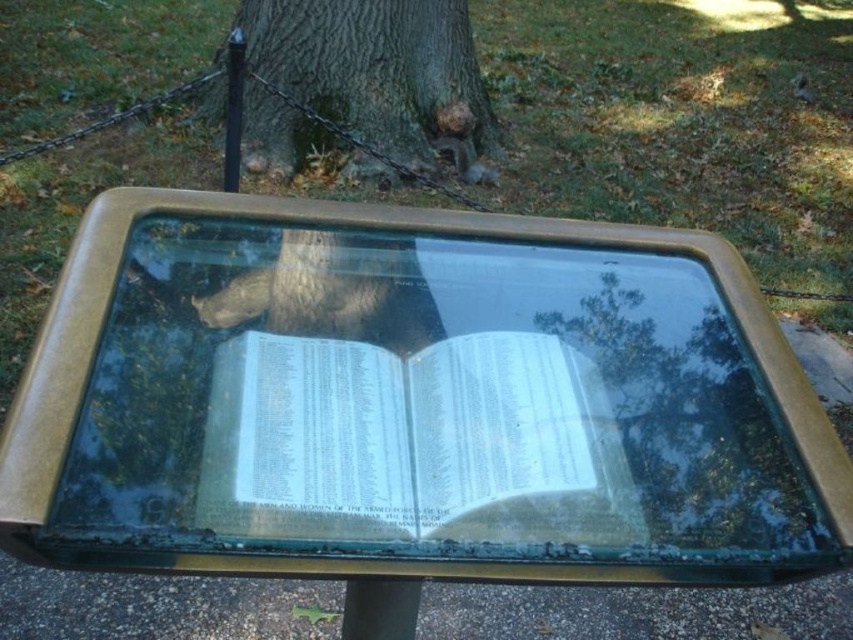
This screenshot has height=640, width=853. Describe the element at coordinates (410, 442) in the screenshot. I see `white paper book at center` at that location.

Does white paper book at center come behind green rough bark tree at center?

No, it is in front of green rough bark tree at center.

Between point (459, 342) and point (489, 124), which one is positioned behind?

Point (489, 124)

Locate an element on the screen. This screenshot has height=640, width=853. white paper book at center is located at coordinates (410, 442).

Is green patina glass table at center positioned at the back of gray fur squirrel at upper center?

No, it is not.

Does green patina glass table at center appear on the left side of gray fur squirrel at upper center?

Indeed, green patina glass table at center is positioned on the left side of gray fur squirrel at upper center.

This screenshot has width=853, height=640. I want to click on green patina glass table at center, so click(x=410, y=394).

Looking at this image, does white paper book at center have a greater height compared to gray fur squirrel at upper center?

In fact, white paper book at center may be shorter than gray fur squirrel at upper center.

Does white paper book at center have a greater width compared to gray fur squirrel at upper center?

Yes, white paper book at center is wider than gray fur squirrel at upper center.

Does point (531, 432) lie behind point (469, 152)?

No.

Locate an element on the screen. This screenshot has width=853, height=640. white paper book at center is located at coordinates (410, 442).